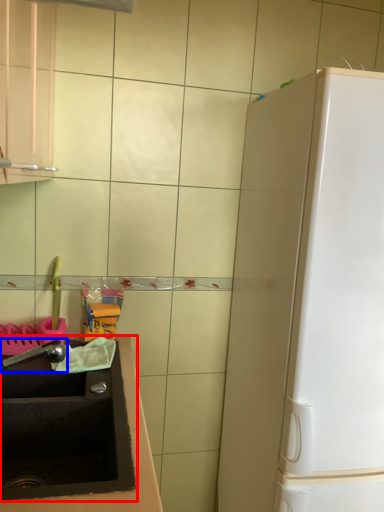
Question: Which of the following is the closest to the observer, sink (highlighted by a red box) or faucet (highlighted by a blue box)?

Choices:
 (A) sink
 (B) faucet

Answer: (A)